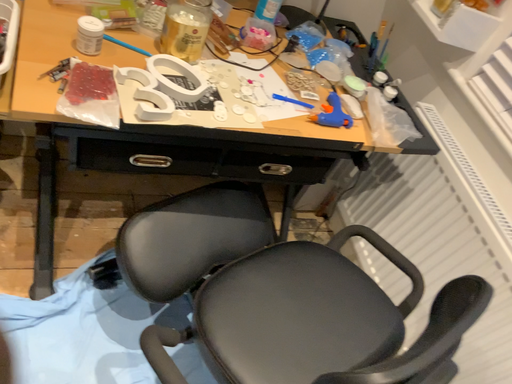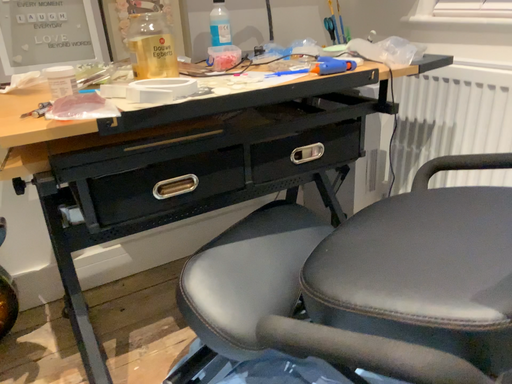
Question: Which way did the camera rotate in the video?

Choices:
 (A) rotated left
 (B) rotated right

Answer: (A)